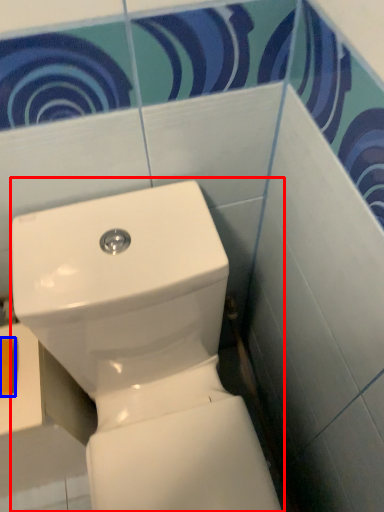
Question: Which point is further to the camera, toilet (highlighted by a red box) or toilet paper (highlighted by a blue box)?

Choices:
 (A) toilet
 (B) toilet paper

Answer: (B)